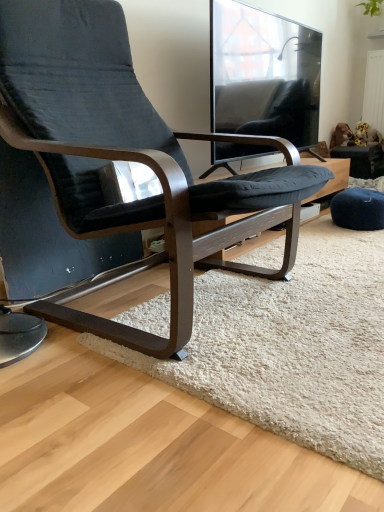
Question: Is matte black chair at center wider than white textured radiator at upper right?

Choices:
 (A) yes
 (B) no

Answer: (A)

Question: From a real-world perspective, is matte black chair at center located beneath white textured radiator at upper right?

Choices:
 (A) yes
 (B) no

Answer: (A)

Question: Can you confirm if matte black chair at center is taller than white textured radiator at upper right?

Choices:
 (A) yes
 (B) no

Answer: (A)

Question: Is matte black chair at center to the right of white textured radiator at upper right from the viewer's perspective?

Choices:
 (A) yes
 (B) no

Answer: (B)

Question: Is matte black chair at center not within white textured radiator at upper right?

Choices:
 (A) no
 (B) yes

Answer: (B)

Question: Do you think transparent glass window at upper center is within white textured radiator at upper right, or outside of it?

Choices:
 (A) inside
 (B) outside

Answer: (B)

Question: From the image's perspective, is transparent glass window at upper center above or below white textured radiator at upper right?

Choices:
 (A) above
 (B) below

Answer: (B)

Question: Considering their positions, is transparent glass window at upper center located in front of or behind white textured radiator at upper right?

Choices:
 (A) front
 (B) behind

Answer: (A)

Question: Is transparent glass window at upper center bigger or smaller than white textured radiator at upper right?

Choices:
 (A) small
 (B) big

Answer: (B)

Question: Is white textured radiator at upper right taller or shorter than white shaggy rug at center?

Choices:
 (A) tall
 (B) short

Answer: (A)

Question: From the image's perspective, is white textured radiator at upper right located above or below white shaggy rug at center?

Choices:
 (A) above
 (B) below

Answer: (A)

Question: Would you say white textured radiator at upper right is to the left or to the right of white shaggy rug at center in the picture?

Choices:
 (A) left
 (B) right

Answer: (B)

Question: From a real-world perspective, is white textured radiator at upper right above or below white shaggy rug at center?

Choices:
 (A) below
 (B) above

Answer: (B)

Question: Based on their positions, is white textured radiator at upper right located to the left or right of matte black chair at center?

Choices:
 (A) right
 (B) left

Answer: (A)

Question: From a real-world perspective, is white textured radiator at upper right above or below matte black chair at center?

Choices:
 (A) above
 (B) below

Answer: (A)